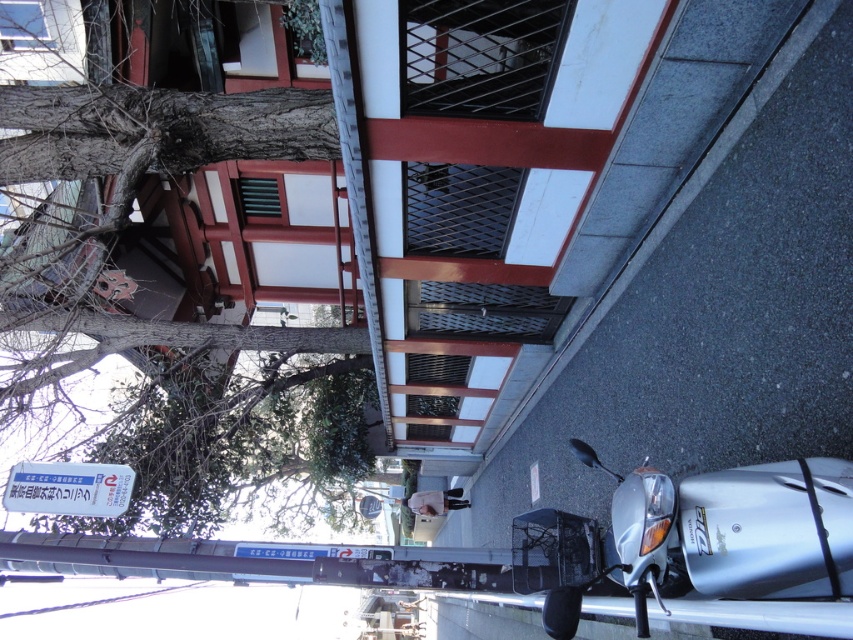
Between smooth brown tree trunk at upper left and silver metallic motorcycle at lower right, which one is positioned higher?

silver metallic motorcycle at lower right is above.

Who is taller, smooth brown tree trunk at upper left or silver metallic motorcycle at lower right?

Standing taller between the two is silver metallic motorcycle at lower right.

Is point (71, 106) positioned after point (761, 493)?

Yes, point (71, 106) is behind point (761, 493).

Locate an element on the screen. The width and height of the screenshot is (853, 640). smooth brown tree trunk at upper left is located at coordinates 172,241.